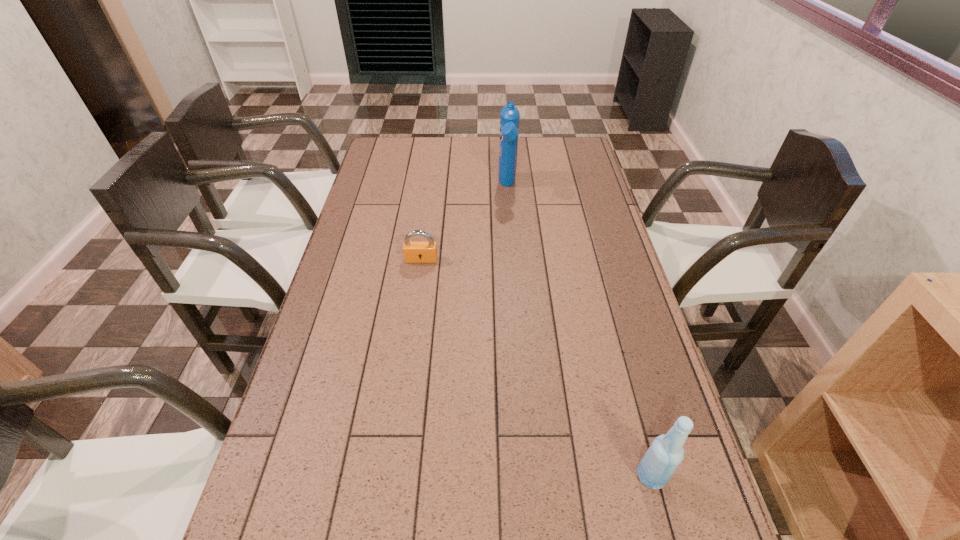
Locate an element on the screen. The height and width of the screenshot is (540, 960). free area in between the second object from right to left and the padlock is located at coordinates (465, 222).

The image size is (960, 540). Find the location of `vacant space that is in between the second object from right to left and the second farthest object`. vacant space that is in between the second object from right to left and the second farthest object is located at coordinates (465, 222).

You are a GUI agent. You are given a task and a screenshot of the screen. Output one action in this format:
    pyautogui.click(x=<x>, y=<y>)
    Task: Click on the blank region between the padlock and the farthest object
    
    Given the screenshot: What is the action you would take?
    [x=465, y=222]

Find the location of a particular element. This screenshot has height=540, width=960. empty space between the tallest object and the padlock is located at coordinates (465, 222).

The width and height of the screenshot is (960, 540). Identify the location of object that is the second closest to the shampoo. (665, 454).

Identify which object is located as the nearest to the padlock. Please provide its 2D coordinates. Your answer should be formatted as a tuple, i.e. [(x, y)], where the tuple contains the x and y coordinates of a point satisfying the conditions above.

[(509, 116)]

Where is `vacant space that satisfies the following two spatial constraints: 1. to unlock the second nearest object from the front; 2. on the left side of the rightmost object`? vacant space that satisfies the following two spatial constraints: 1. to unlock the second nearest object from the front; 2. on the left side of the rightmost object is located at coordinates (392, 476).

What are the coordinates of `vacant point that satisfies the following two spatial constraints: 1. on the front side of the bottle; 2. on the right side of the shampoo` in the screenshot? It's located at (530, 476).